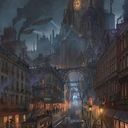
Image resolution: width=128 pixels, height=128 pixels. Identify the location of lit windows. (121, 124), (126, 125), (116, 123), (17, 118), (10, 116), (4, 118), (24, 117).